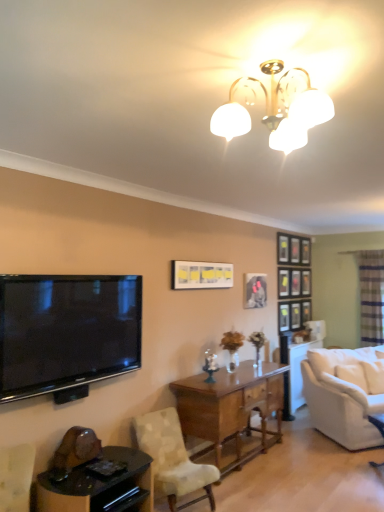
Question: Is matte yellow picture frame at center, which appears as the second picture frame when viewed from the back, situated inside white fabric couch at right or outside?

Choices:
 (A) inside
 (B) outside

Answer: (B)

Question: Considering the positions of point (198, 283) and point (372, 430), is point (198, 283) closer or farther from the camera than point (372, 430)?

Choices:
 (A) closer
 (B) farther

Answer: (A)

Question: Based on their relative distances, which object is nearer to the matte yellow picture frame at center, placed as the first picture frame when sorted from front to back?

Choices:
 (A) translucent glass door at right
 (B) black glossy table at lower left
 (C) flat-screen tv at left
 (D) matte black picture frame at center, which is the first picture frame in back-to-front order
 (E) white fabric couch at right

Answer: (D)

Question: Which object is positioned closest to the matte yellow picture frame at center, which ranks as the 1th picture frame in left-to-right order?

Choices:
 (A) translucent glass door at right
 (B) black glossy table at lower left
 (C) flat-screen tv at left
 (D) matte black picture frame at center, which appears as the first picture frame when viewed from the right
 (E) mahogany wood desk at center

Answer: (D)